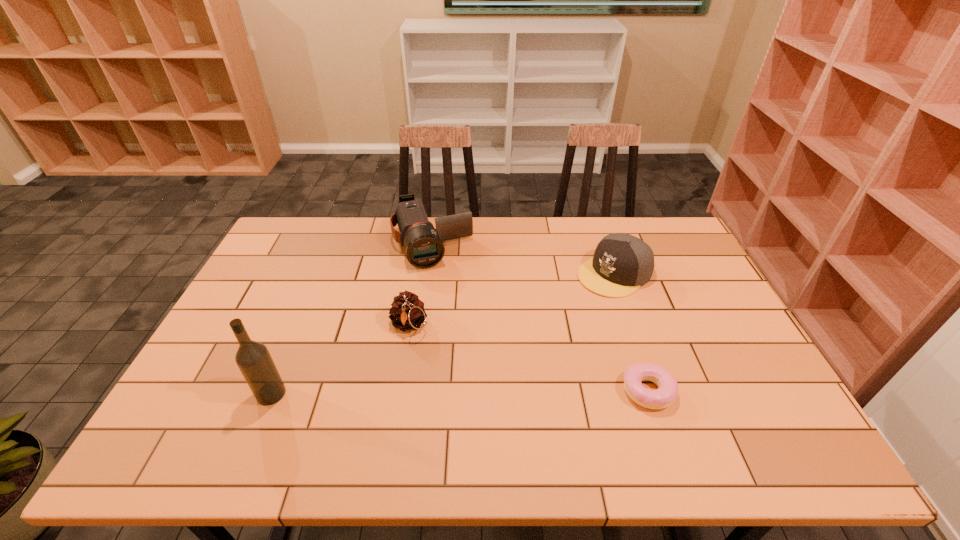
This screenshot has height=540, width=960. In order to click on the leftmost object in this screenshot , I will do `click(253, 359)`.

This screenshot has height=540, width=960. In order to click on vodka in this screenshot , I will do `click(253, 359)`.

Where is `doughnut`? The width and height of the screenshot is (960, 540). doughnut is located at coordinates coord(664,396).

Where is `cap`? The height and width of the screenshot is (540, 960). cap is located at coordinates (622, 263).

The height and width of the screenshot is (540, 960). In order to click on camcorder in this screenshot , I will do `click(423, 243)`.

Where is `pinecone`? pinecone is located at coordinates (407, 312).

Image resolution: width=960 pixels, height=540 pixels. What are the coordinates of `blank space located 0.150m on the right of the vodka` in the screenshot? It's located at (346, 394).

The image size is (960, 540). I want to click on vacant area situated 0.230m on the back of the doughnut, so click(x=620, y=308).

The image size is (960, 540). Identify the location of free location located on the front-facing side of the cap. (567, 302).

At what (x,y) coordinates should I click in order to perform the action: click on free space located 0.250m on the front-facing side of the cap. Please return your answer as a coordinate pair (x, y). This screenshot has height=540, width=960. Looking at the image, I should click on (531, 325).